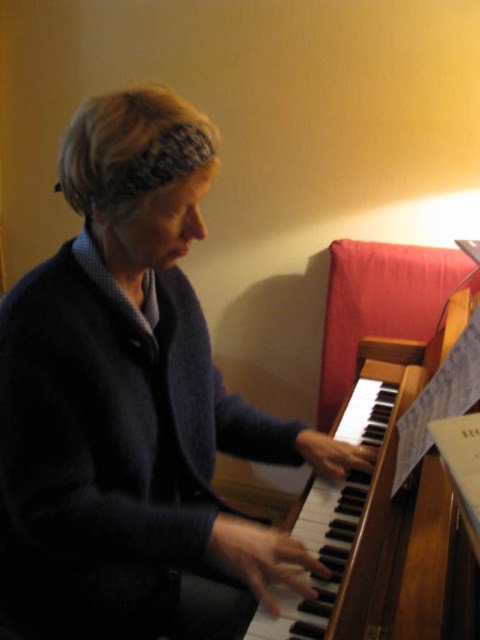
Does point (104, 433) come behind point (457, 592)?

Yes.

Is point (184, 436) positioned before point (324, 582)?

That is False.

Who is more forward, (x=72, y=573) or (x=466, y=406)?

Positioned in front is point (x=466, y=406).

Find the location of a particular element. dark blue sweater at center is located at coordinates (133, 406).